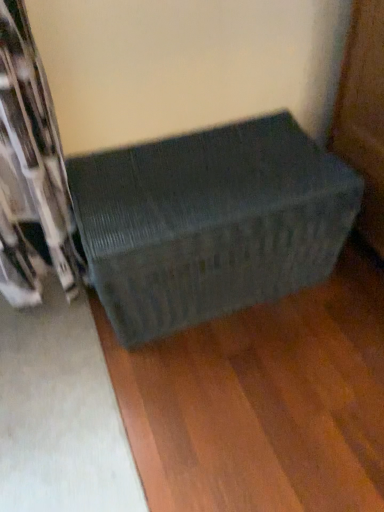
The image size is (384, 512). I want to click on textured gray chest at center, so click(x=209, y=222).

What do you see at coordinates (209, 222) in the screenshot?
I see `textured gray chest at center` at bounding box center [209, 222].

In order to face textured gray chest at center, should I rotate leftwards or rightwards?

Turn right approximately 2.029 degrees to face it.

Where is `textured gray chest at center`? This screenshot has height=512, width=384. textured gray chest at center is located at coordinates (209, 222).